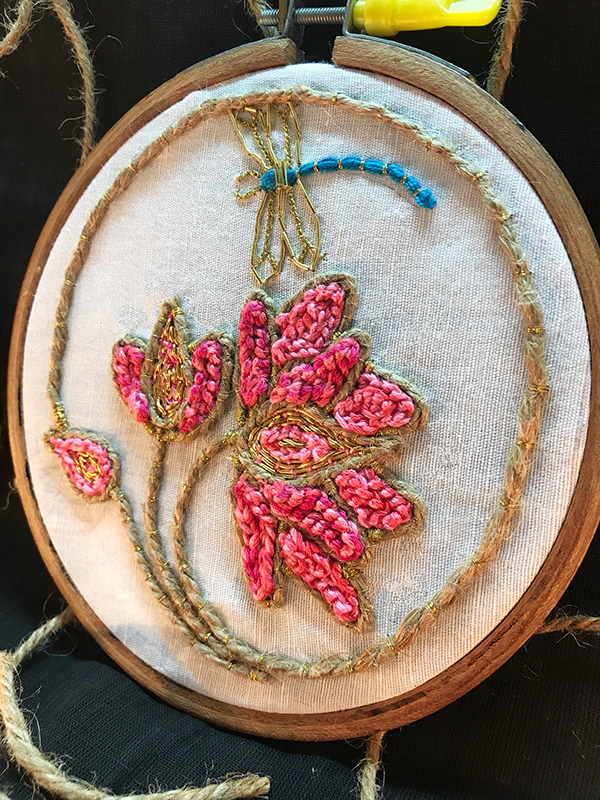
The image size is (600, 800). Identify the location of wooden frame. (289, 714).